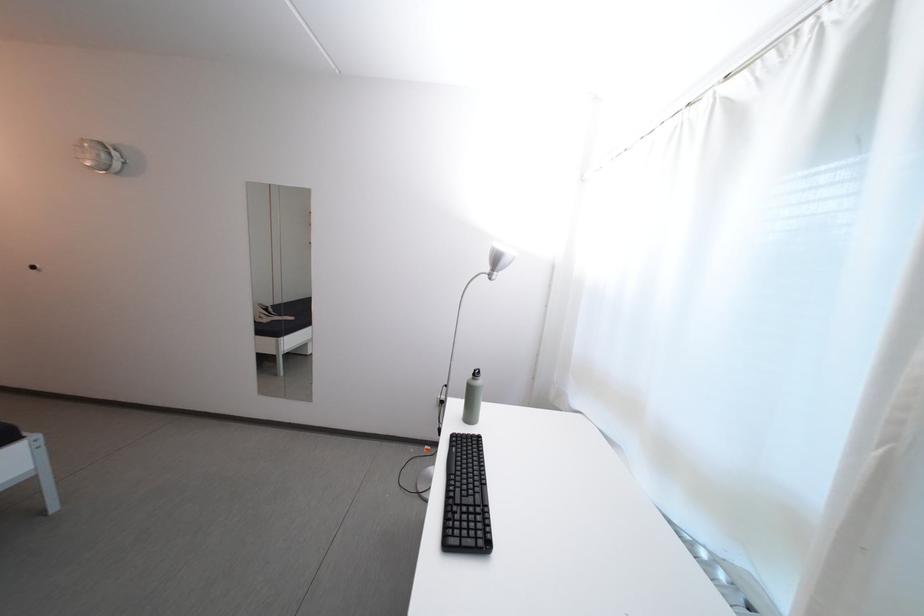
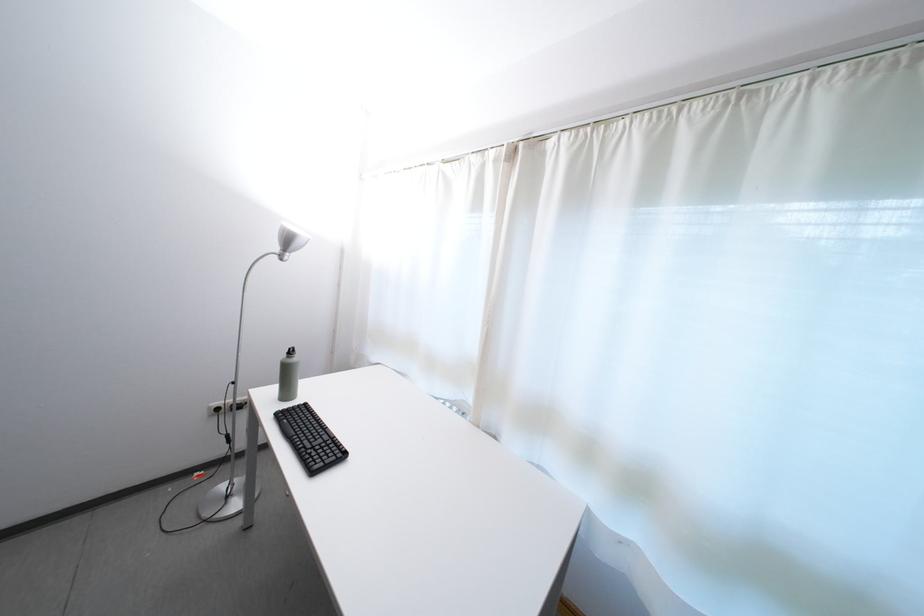
The point at (480, 382) is marked in the first image. Where is the corresponding point in the second image?

(294, 361)